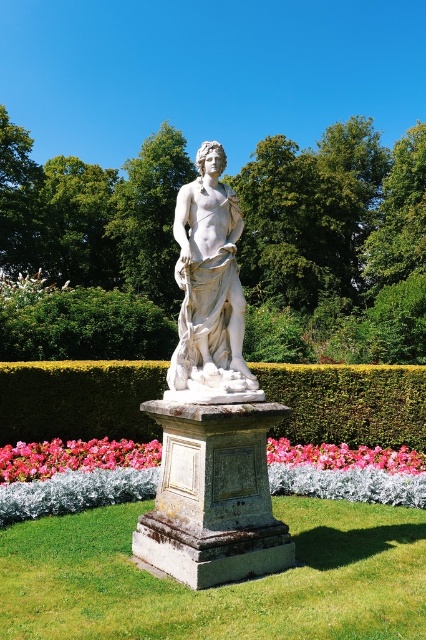
Between pink fabric flower at lower center and pink floral bed at lower center, which one appears on the right side from the viewer's perspective?

pink floral bed at lower center is more to the right.

At what (x,y) coordinates should I click in order to perform the action: click on pink fabric flower at lower center. Please return your answer as a coordinate pair (x, y). Looking at the image, I should click on (74, 458).

Who is more forward, (112, 444) or (388, 467)?

Point (388, 467) is in front.

Where is `pink fabric flower at lower center`? This screenshot has height=640, width=426. pink fabric flower at lower center is located at coordinates (74, 458).

Does point (239, 372) come farther from viewer compared to point (321, 460)?

No, it is not.

Does white marble statue at center have a greater width compared to pink floral bed at lower center?

In fact, white marble statue at center might be narrower than pink floral bed at lower center.

Between point (193, 298) and point (294, 458), which one is positioned behind?

The point (294, 458) is more distant.

Identify the location of white marble statue at center. The width and height of the screenshot is (426, 640). (209, 291).

From the picture: Between white marble statue at center and pink fabric flower at lower center, which one has more height?

white marble statue at center

Is white marble statue at center below pink fabric flower at lower center?

No.

Image resolution: width=426 pixels, height=640 pixels. I want to click on white marble statue at center, so click(209, 291).